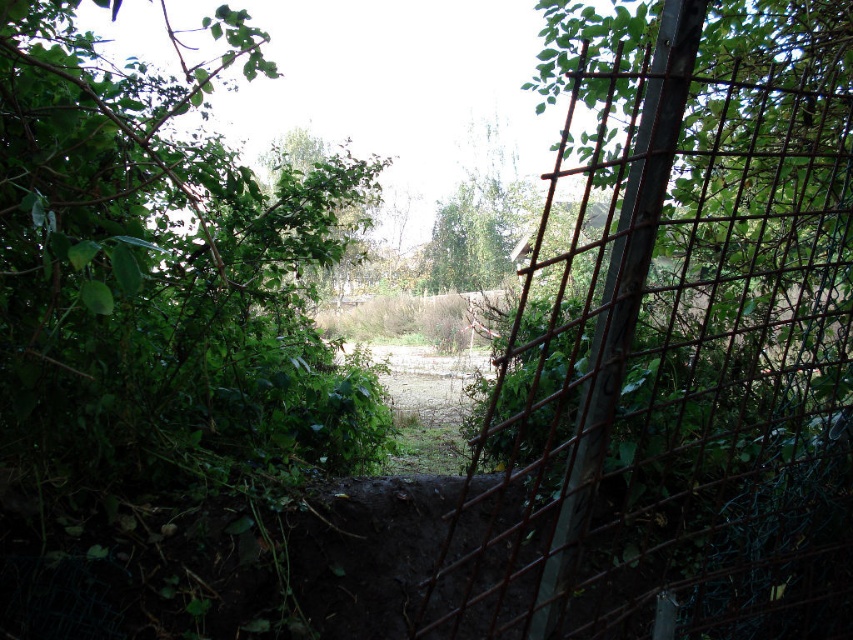
Question: Is rusty metal trellis at center right behind green leafy tree at center?

Choices:
 (A) no
 (B) yes

Answer: (A)

Question: Does rusty metal trellis at center right have a lesser width compared to green leafy tree at center?

Choices:
 (A) no
 (B) yes

Answer: (A)

Question: Is rusty metal trellis at center right thinner than green leafy tree at center?

Choices:
 (A) no
 (B) yes

Answer: (A)

Question: Among these points, which one is nearest to the camera?

Choices:
 (A) pyautogui.click(x=840, y=266)
 (B) pyautogui.click(x=480, y=232)

Answer: (A)

Question: Which point appears farthest from the camera in this image?

Choices:
 (A) (836, 26)
 (B) (465, 192)

Answer: (B)